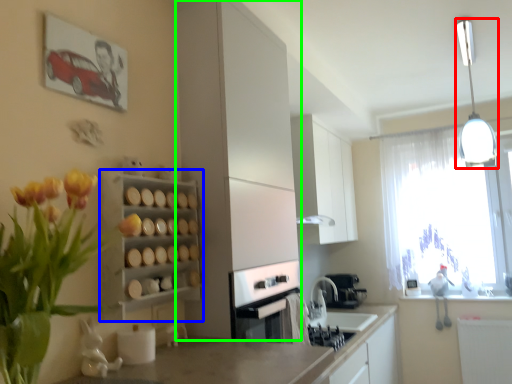
Question: Considering the real-world distances, which object is closest to light fixture (highlighted by a red box)? shelf (highlighted by a blue box) or cabinetry (highlighted by a green box).

Choices:
 (A) shelf
 (B) cabinetry

Answer: (B)